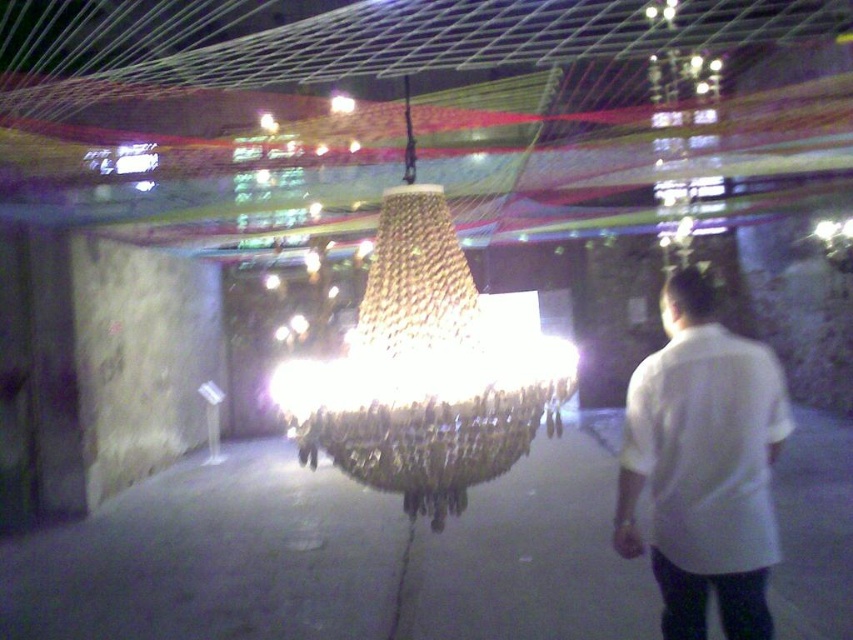
Which of these two, iridescent glass chandelier at center or white cotton shirt at right, stands shorter?

white cotton shirt at right is shorter.

Which of these two, iridescent glass chandelier at center or white cotton shirt at right, stands taller?

With more height is iridescent glass chandelier at center.

Measure the distance between point (297, 429) and camera.

The distance of point (297, 429) from camera is 8.72 feet.

Image resolution: width=853 pixels, height=640 pixels. I want to click on iridescent glass chandelier at center, so (x=428, y=369).